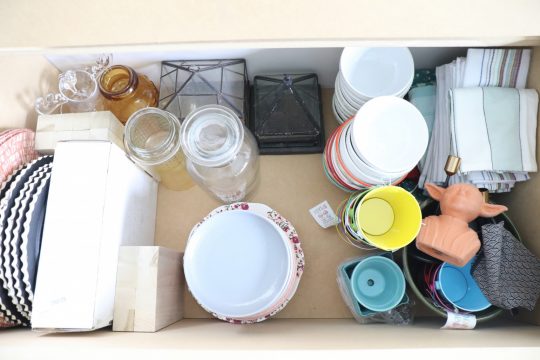
Image resolution: width=540 pixels, height=360 pixels. Identify the location of rag. (507, 281).